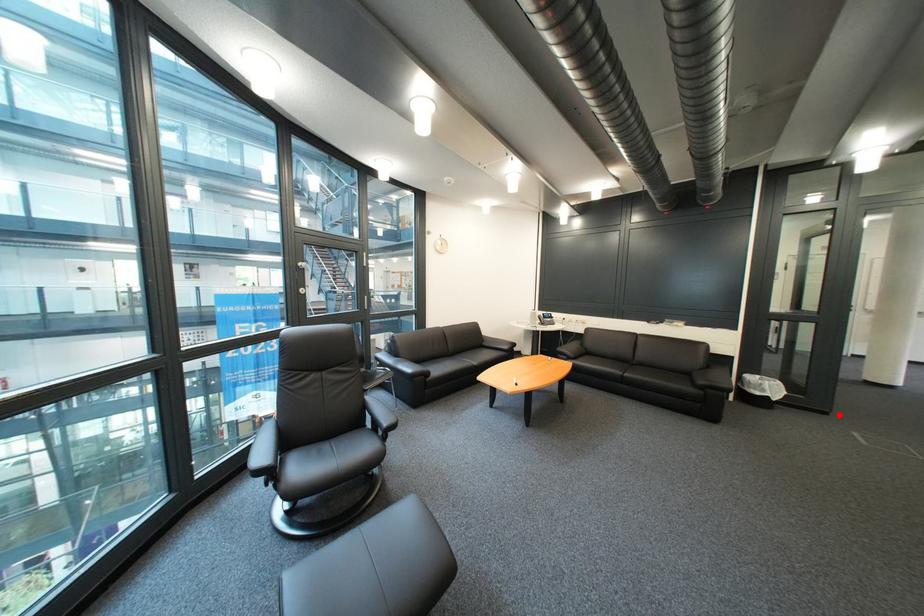
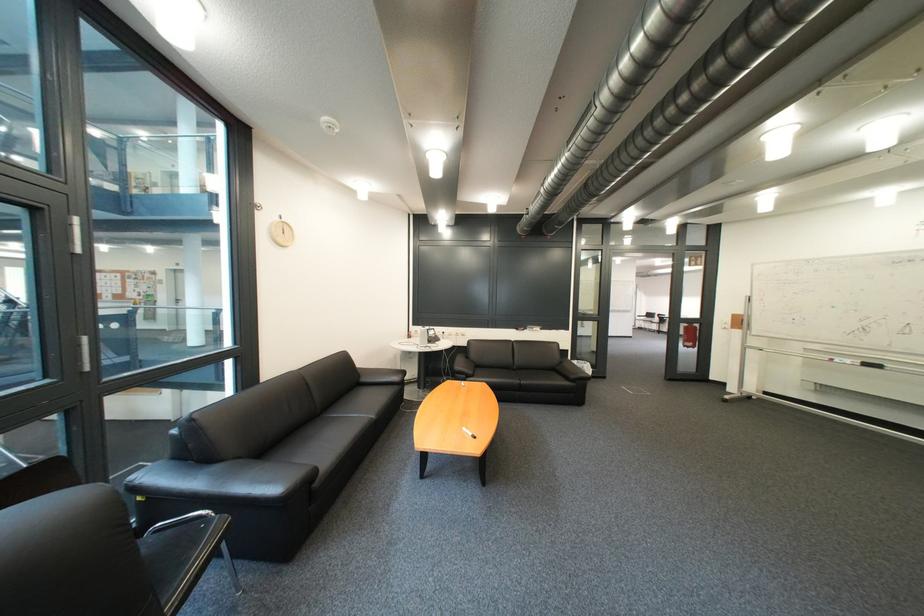
Question: I am providing you with two images of the same scene from different viewpoints. A red point is shown in image1. For the corresponding object point in image2, is it positioned nearer or farther from the camera?

Choices:
 (A) Nearer
 (B) Farther

Answer: (B)